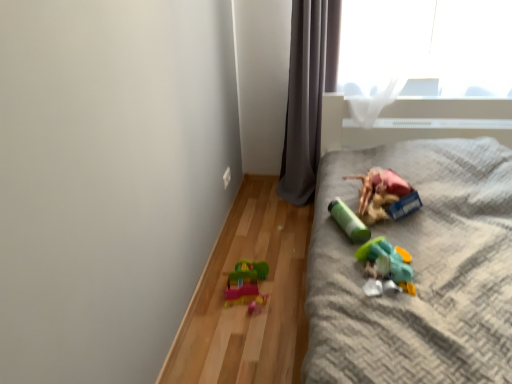
At what (x,y) coordinates should I click in order to perform the action: click on vacant area that lies in front of gray fabric curtain at upper center. Please return your answer as a coordinate pair (x, y). Looking at the image, I should click on (289, 218).